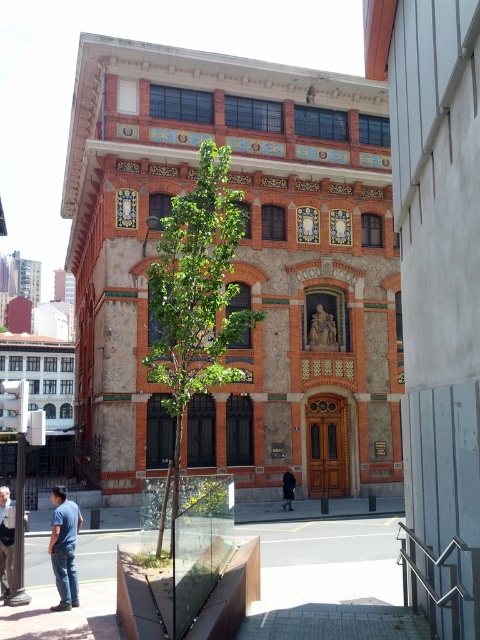
In the scene shown: You are standing in front of the building and notice the blue denim jeans at lower left and the dark gray coat at center. Which item is nearer to you?

The blue denim jeans at lower left are closer to the viewer than the dark gray coat at center.

You are standing in front of the building and want to take a photo that includes both point (57, 557) and point (283, 506). Which point should you focus on to ensure both are in sharp focus?

You should focus on point (283, 506) because it is farther from the camera than point (57, 557). By focusing on the farther point, the closer point will also be within the depth of field, ensuring both are in sharp focus.

You are standing in front of the building and see the green leafy tree at center and the dark gray coat at center. Which object is bigger in size?

The green leafy tree at center is larger in size compared to the dark gray coat at center.